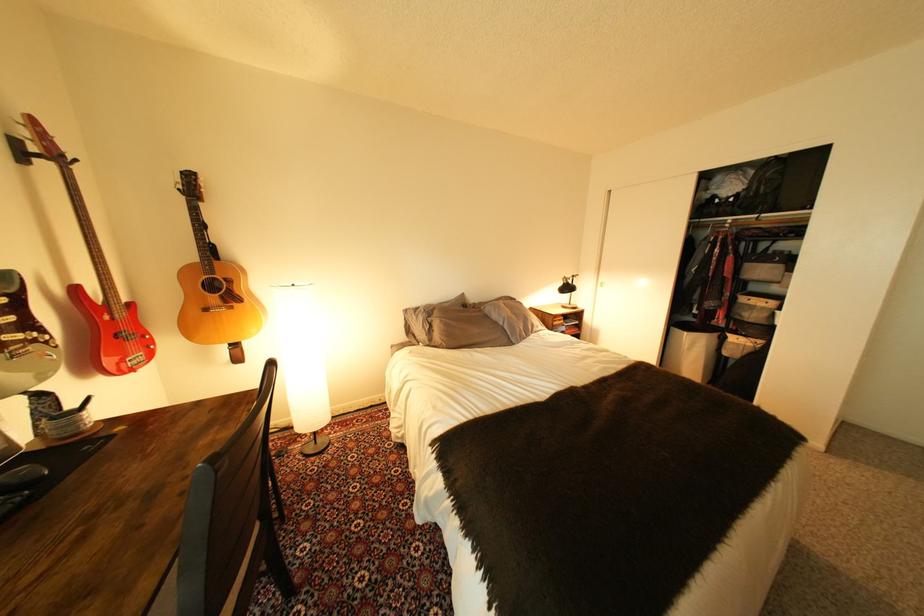
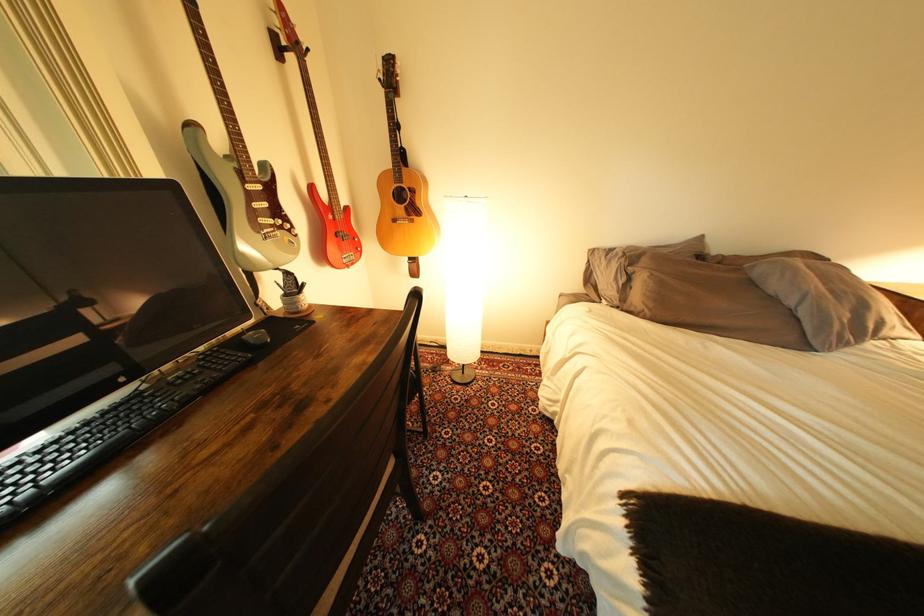
Where in the second image is the point corresponding to point 419,313 from the first image?

(604, 253)